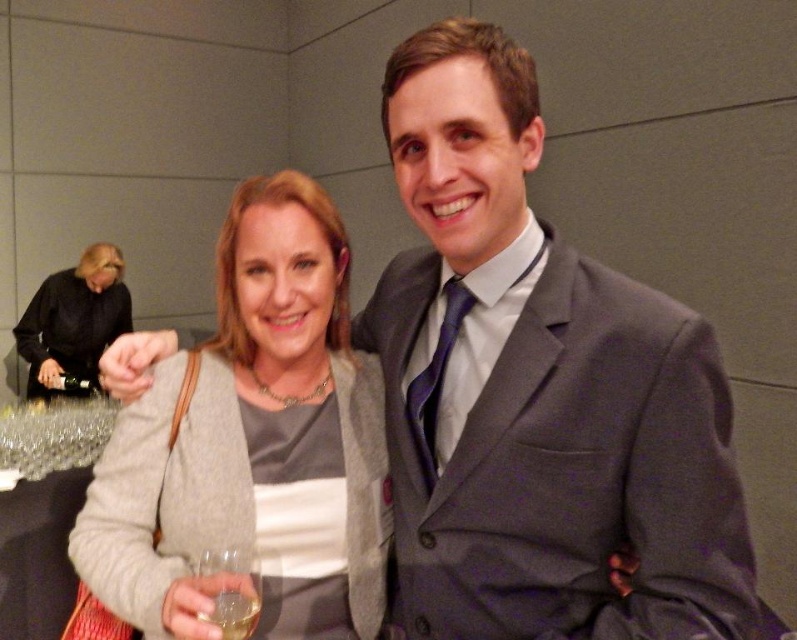
Question: Is gray wool suit at center behind black leather jacket at upper left?

Choices:
 (A) yes
 (B) no

Answer: (B)

Question: Is clear glass wine glass at lower left positioned in front of clear glass wine at lower left?

Choices:
 (A) yes
 (B) no

Answer: (A)

Question: Which of these objects is positioned closest to the black leather jacket at upper left?

Choices:
 (A) matte gray sweater at center
 (B) clear glass wine at lower left
 (C) gray wool suit at center

Answer: (A)

Question: Is matte gray sweater at center below black leather jacket at upper left?

Choices:
 (A) no
 (B) yes

Answer: (B)

Question: Which of the following is the closest to the observer?

Choices:
 (A) pos(550,490)
 (B) pos(238,465)
 (C) pos(246,602)
 (D) pos(228,612)

Answer: (D)

Question: Which object is closer to the camera taking this photo?

Choices:
 (A) clear glass wine at lower left
 (B) gray wool suit at center
 (C) matte gray sweater at center
 (D) black leather jacket at upper left

Answer: (C)